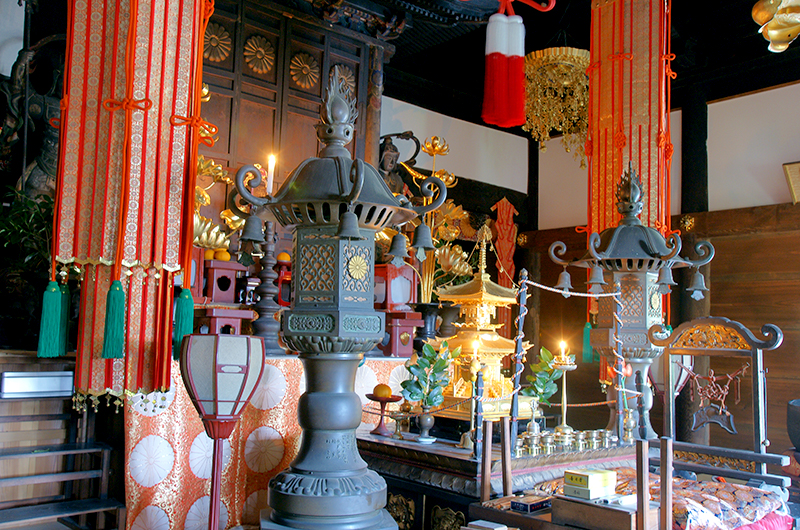
You are a GUI agent. You are given a task and a screenshot of the screen. Output one action in this format:
    pyautogui.click(x=<x>, y=<y>)
    Task: Click on the book
    
    Given the screenshot: What is the action you would take?
    pyautogui.click(x=584, y=482), pyautogui.click(x=589, y=506)